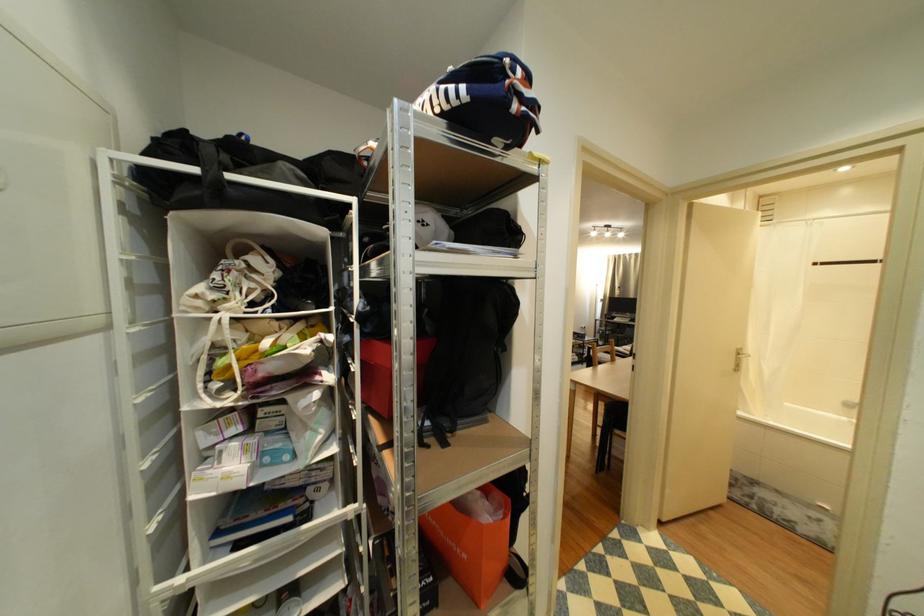
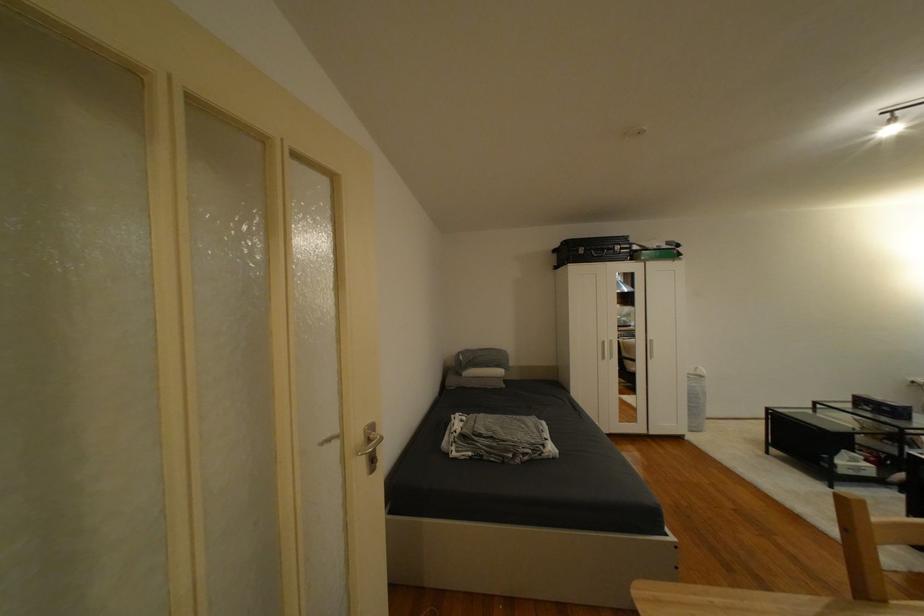
Where in the second image is the point corresponding to the point at 589,336 from the first image?

(894, 410)